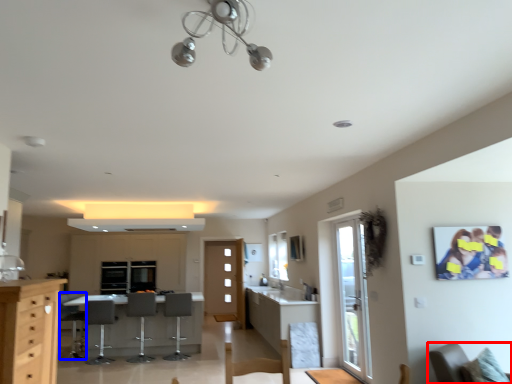
Question: Which of the following is the closest to the observer, chair (highlighted by a red box) or armchair (highlighted by a blue box)?

Choices:
 (A) chair
 (B) armchair

Answer: (A)